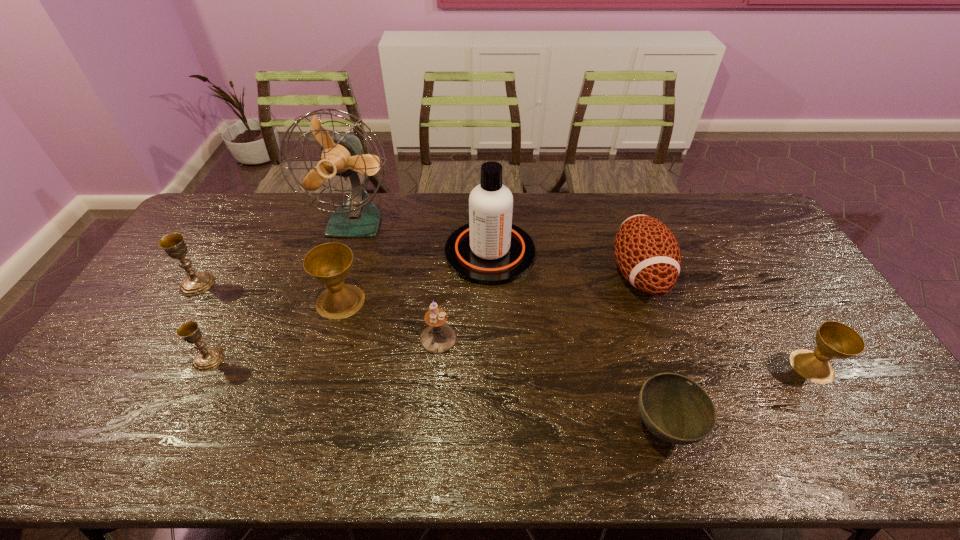
Locate an element on the screen. Image resolution: width=960 pixels, height=540 pixels. vacant space at the far edge of the desktop is located at coordinates (589, 200).

This screenshot has height=540, width=960. Identify the location of vacant region at the near edge of the desktop. (369, 455).

This screenshot has height=540, width=960. What are the coordinates of `vacant region at the left edge of the desktop` in the screenshot? It's located at (211, 273).

In the image, there is a desktop. Where is `vacant region at the right edge`? vacant region at the right edge is located at coordinates (804, 285).

At what (x,y) coordinates should I click in order to perform the action: click on vacant position at the far left corner of the desktop. Please return your answer as a coordinate pair (x, y). This screenshot has width=960, height=540. Looking at the image, I should click on coord(228,210).

Where is `free space between the leftmost chalice and the tallest object`? free space between the leftmost chalice and the tallest object is located at coordinates (276, 253).

The height and width of the screenshot is (540, 960). I want to click on empty location between the rightmost object and the fan, so click(584, 294).

In order to click on vacant region between the bowl and the bigger gold chalice in this screenshot , I will do `click(430, 356)`.

The width and height of the screenshot is (960, 540). I want to click on vacant area between the candle holder and the left brown chalice, so click(390, 320).

This screenshot has width=960, height=540. I want to click on free space between the cleansing agent and the shortest object, so click(x=577, y=340).